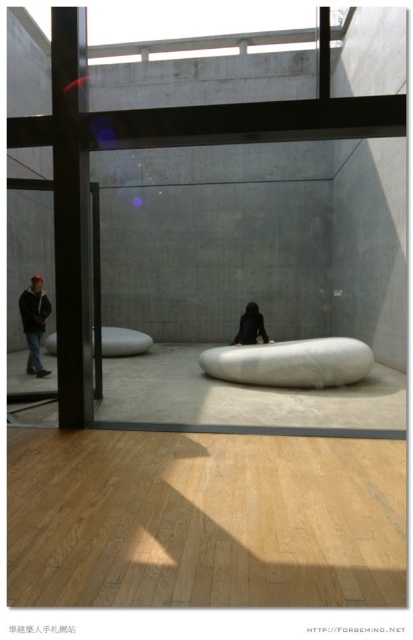
You are organizing a charity clothing drive and need to determine which items are suitable for donation. According to the scene, which clothing item has a larger size between the dark gray hoodie at left and the dark brown leather jacket at center?

The dark gray hoodie at left is larger in size than the dark brown leather jacket at center, so the dark gray hoodie at left is the larger one and would be suitable for donation if size is a consideration.

Based on the provided scene description, what is located at the coordinates point (33, 323)?

A dark gray hoodie is located at point (33, 323).